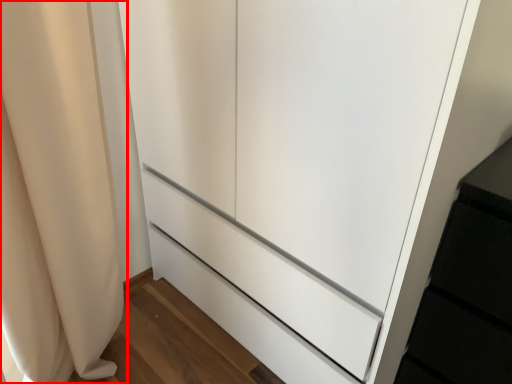
Question: Observing the image, what is the correct spatial positioning of curtain (annotated by the red box) in reference to cupboard?

Choices:
 (A) left
 (B) right

Answer: (A)